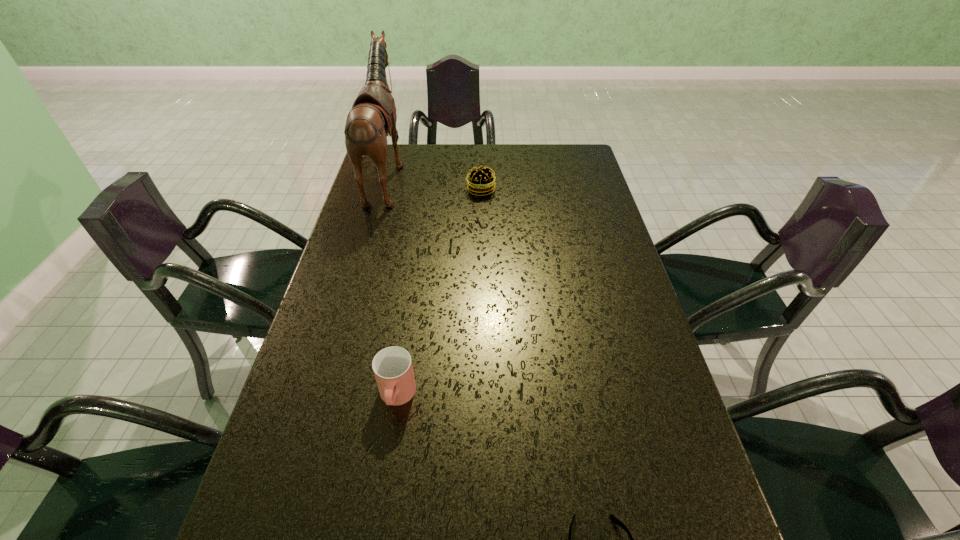
Locate an element on the screen. The image size is (960, 540). the tallest object is located at coordinates (372, 118).

You are a GUI agent. You are given a task and a screenshot of the screen. Output one action in this format:
    pyautogui.click(x=<x>, y=<y>)
    Task: Click on the leftmost object
    The height and width of the screenshot is (540, 960).
    Given the screenshot: What is the action you would take?
    coord(372,118)

You are a GUI agent. You are given a task and a screenshot of the screen. Output one action in this format:
    pyautogui.click(x=<x>, y=<y>)
    Task: Click on the third shortest object
    The image size is (960, 540).
    Given the screenshot: What is the action you would take?
    click(392, 366)

The height and width of the screenshot is (540, 960). Find the location of `the second nearest object`. the second nearest object is located at coordinates (392, 366).

Where is `the second shortest object`? the second shortest object is located at coordinates (480, 181).

Identify the location of the second object from right to left. (480, 181).

Locate an element on the screen. This screenshot has height=540, width=960. free point located on the back of the tallest object is located at coordinates [425, 176].

I want to click on free space located on the side of the third object from right to left with the handle, so point(386,465).

Image resolution: width=960 pixels, height=540 pixels. What are the coordinates of `vacant area situated 0.290m on the left of the second shortest object` in the screenshot? It's located at (382, 190).

Find the location of `object located at the far edge`. object located at the far edge is located at coordinates (372, 118).